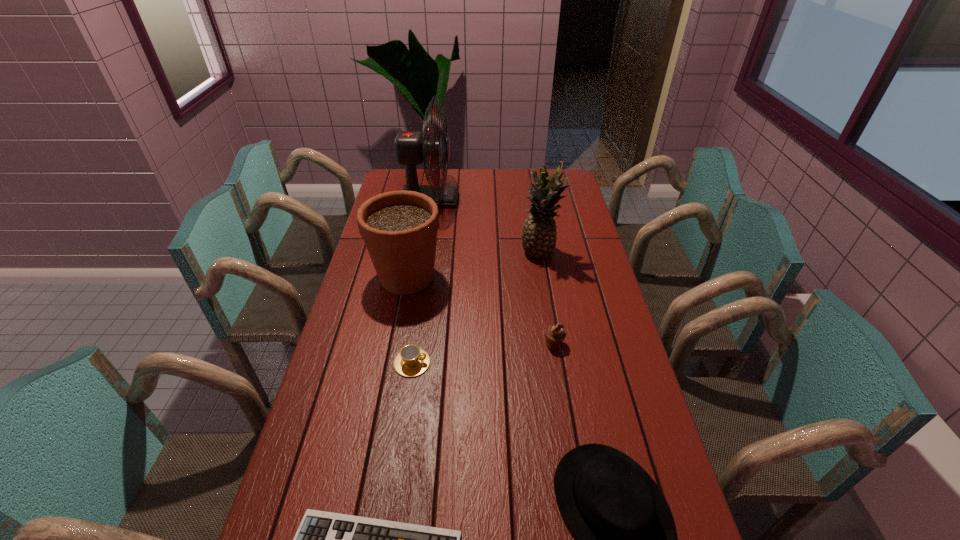
Image resolution: width=960 pixels, height=540 pixels. Identify the location of vacant space that's between the third tallest object and the muffin. (480, 310).

The width and height of the screenshot is (960, 540). I want to click on vacant space that's between the muffin and the fan, so click(x=492, y=272).

At what (x,y) coordinates should I click in order to perform the action: click on vacant space in between the third tallest object and the sixth shortest object. Please return your answer as a coordinate pair (x, y). The height and width of the screenshot is (540, 960). Looking at the image, I should click on (x=473, y=265).

Find the location of a particular element. Image resolution: width=960 pixels, height=540 pixels. the second closest object to the fedora is located at coordinates (554, 334).

Choose which object is the sixth nearest neighbor to the flowerpot. Please provide its 2D coordinates. Your answer should be formatted as a tuple, i.e. [(x, y)], where the tuple contains the x and y coordinates of a point satisfying the conditions above.

[(324, 539)]

The width and height of the screenshot is (960, 540). In order to click on vacant region that satisfies the following two spatial constraints: 1. on the front-facing side of the pineapple; 2. on the left side of the fan in this screenshot , I will do `click(420, 254)`.

Identify the location of free space that satisfies the following two spatial constraints: 1. on the front-facing side of the farthest object; 2. on the left side of the pineapple. (420, 254).